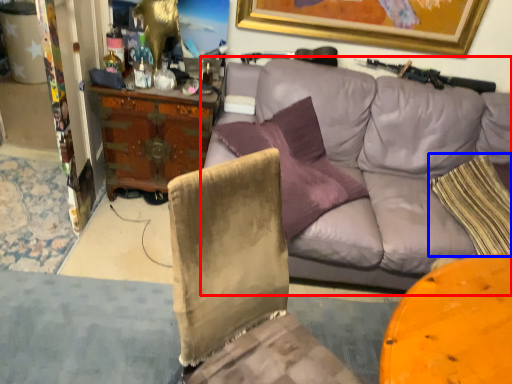
Question: Which of the following is the closest to the observer, studio couch (highlighted by a red box) or pillow (highlighted by a blue box)?

Choices:
 (A) studio couch
 (B) pillow

Answer: (A)